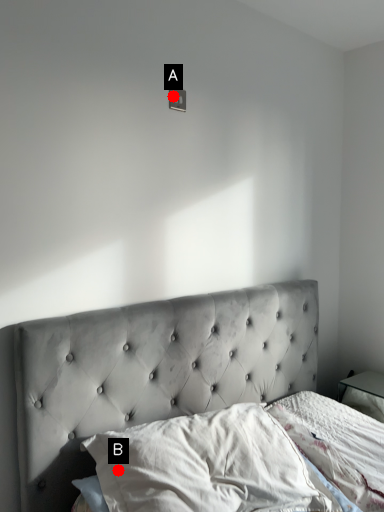
Question: Two points are circled on the image, labeled by A and B beside each circle. Among these points, which one is nearest to the camera?

Choices:
 (A) A is closer
 (B) B is closer

Answer: (B)